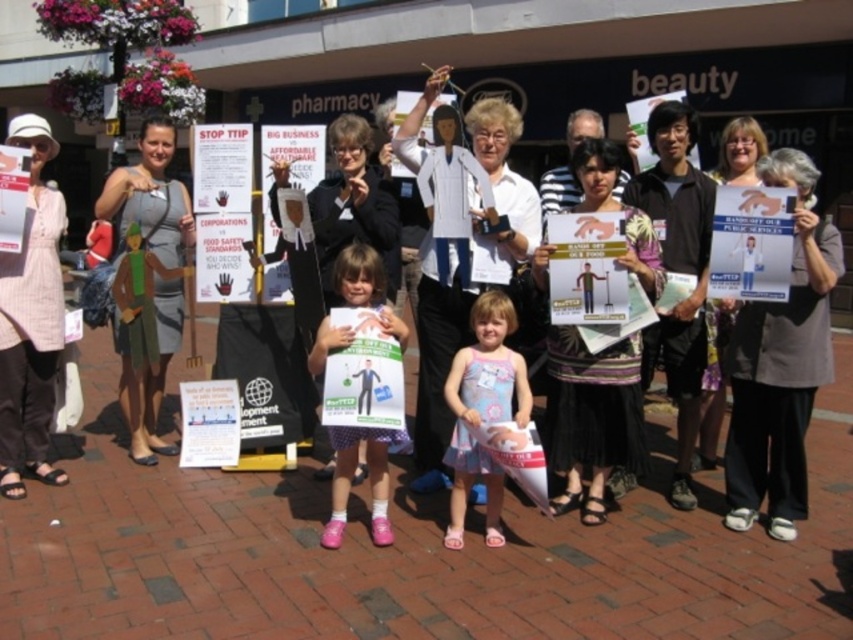
Question: Which of these objects is positioned farthest from the matte black coat at center?

Choices:
 (A) white paper doll at center
 (B) striped fabric shirt at center
 (C) matte black shirt at center
 (D) pink fabric dress at center

Answer: (C)

Question: Estimate the real-world distances between objects in this image. Which object is farther from the matte black coat at center?

Choices:
 (A) matte gray dress at center
 (B) striped fabric shirt at center
 (C) pink fabric dress at center

Answer: (A)

Question: In this image, where is gray fabric jacket at center located relative to pink fabric dress at center?

Choices:
 (A) left
 (B) right

Answer: (B)

Question: Which object is positioned farthest from the matte gray dress at center?

Choices:
 (A) gray fabric jacket at center
 (B) pink fabric dress at center

Answer: (A)

Question: Does striped fabric shirt at center have a larger size compared to light pink woven dress at left?

Choices:
 (A) no
 (B) yes

Answer: (B)

Question: Is light pink woven dress at left further to camera compared to white paper doll at center?

Choices:
 (A) no
 (B) yes

Answer: (A)